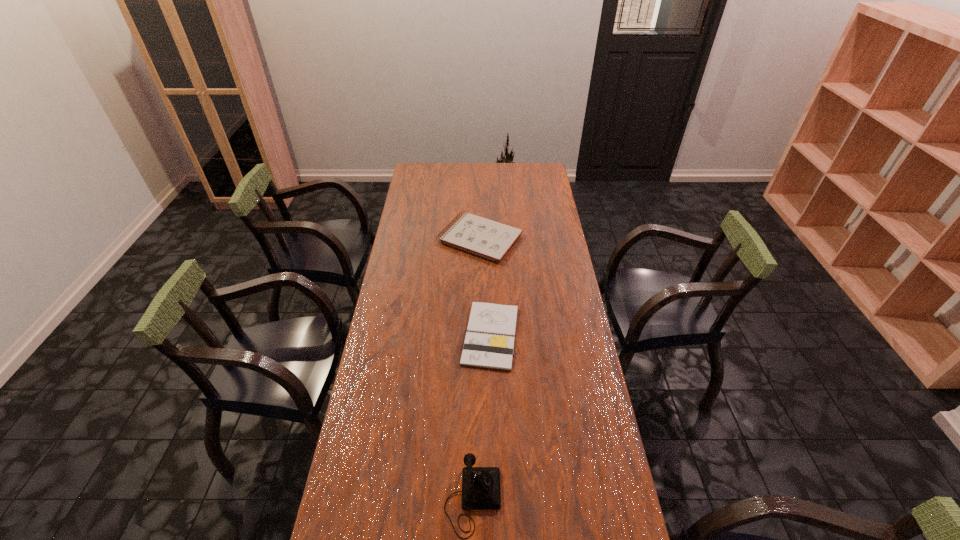
You are a GUI agent. You are given a task and a screenshot of the screen. Output one action in this format:
    pyautogui.click(x=<x>, y=<y>)
    Task: Click on the unoccupied area between the telephone and the shorter notepad
    This screenshot has height=540, width=960.
    Given the screenshot: What is the action you would take?
    point(482,417)

Identify the location of vacant area that lies between the nearest object and the shorter notepad. (482, 417).

Where is `object that can be found as the second closest to the farthest object`? The height and width of the screenshot is (540, 960). object that can be found as the second closest to the farthest object is located at coordinates (480, 485).

Locate an element on the screen. Image resolution: width=960 pixels, height=540 pixels. object that ranks as the second closest to the shorter notepad is located at coordinates (480, 485).

Locate an element on the screen. This screenshot has width=960, height=540. vacant area that satisfies the following two spatial constraints: 1. on the front side of the taller notepad; 2. on the front face of the tallest object is located at coordinates (480, 498).